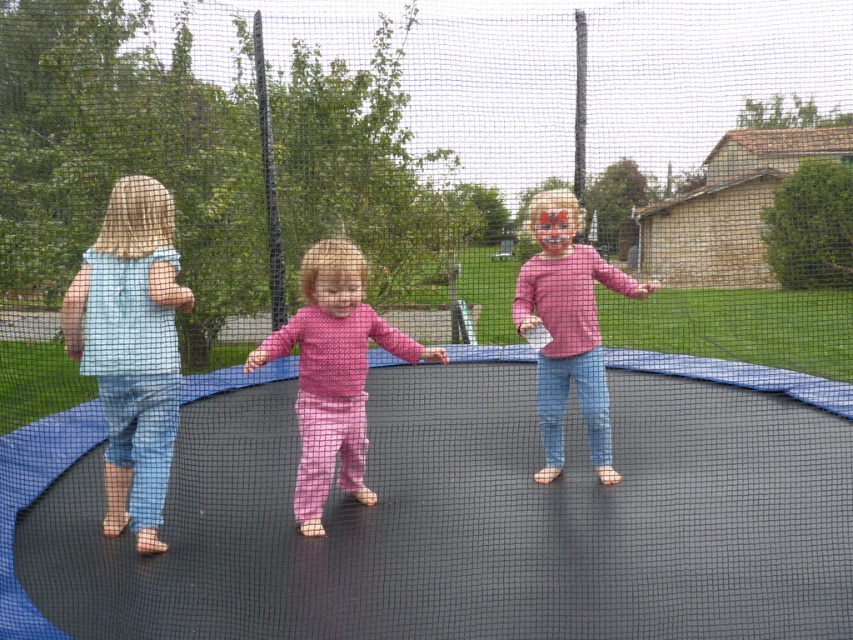
Looking at this image, is light blue denim jumpsuit at left smaller than pink matte shirt at center?

Correct, light blue denim jumpsuit at left occupies less space than pink matte shirt at center.

Who is positioned more to the left, light blue denim jumpsuit at left or pink matte shirt at center?

From the viewer's perspective, light blue denim jumpsuit at left appears more on the left side.

The width and height of the screenshot is (853, 640). Find the location of `light blue denim jumpsuit at left`. light blue denim jumpsuit at left is located at coordinates (131, 348).

Which is more to the right, light blue denim jumpsuit at left or pink fabric pants at center?

pink fabric pants at center

Can you confirm if light blue denim jumpsuit at left is positioned to the left of pink fabric pants at center?

Indeed, light blue denim jumpsuit at left is positioned on the left side of pink fabric pants at center.

Does point (157, 392) come behind point (323, 481)?

That is False.

Find the location of a particular element. Image resolution: width=853 pixels, height=640 pixels. light blue denim jumpsuit at left is located at coordinates (131, 348).

Who is more forward, (347, 374) or (550, 324)?

Point (347, 374) is more forward.

Can you confirm if pink fabric pants at center is smaller than pink matte shirt at center?

Incorrect, pink fabric pants at center is not smaller in size than pink matte shirt at center.

This screenshot has width=853, height=640. What do you see at coordinates (334, 372) in the screenshot?
I see `pink fabric pants at center` at bounding box center [334, 372].

The height and width of the screenshot is (640, 853). Find the location of `pink fabric pants at center`. pink fabric pants at center is located at coordinates (334, 372).